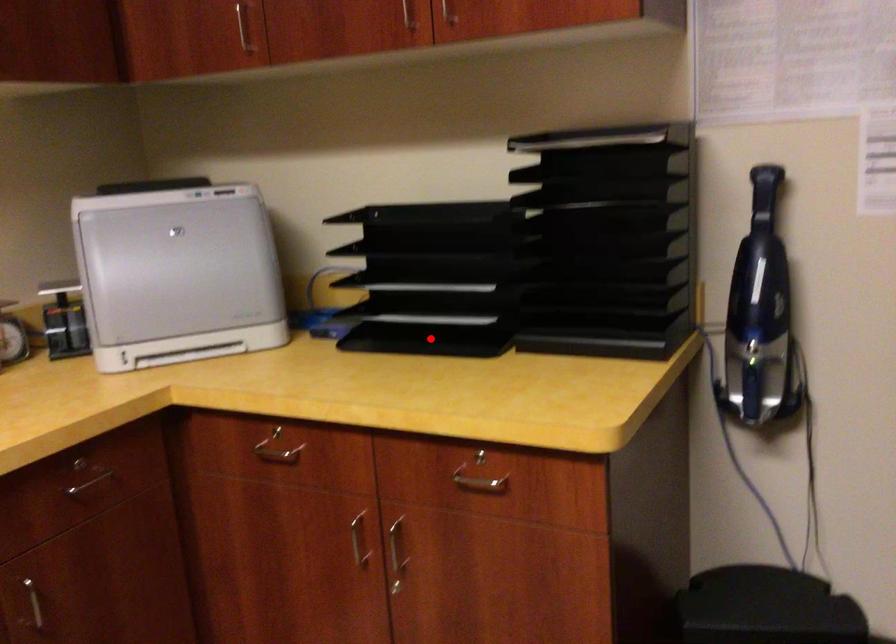
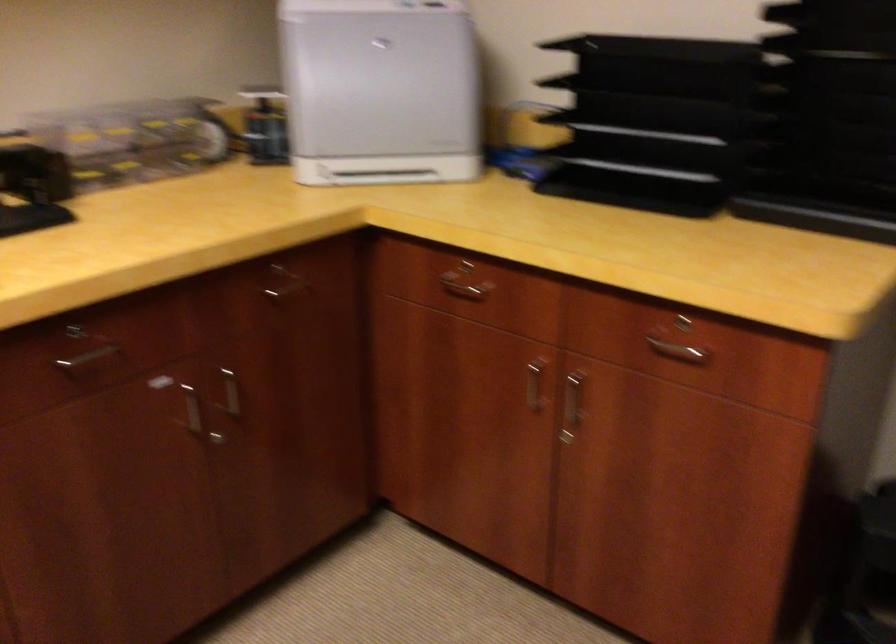
In the second image, find the point that corresponds to the highlighted location in the first image.

(632, 190)